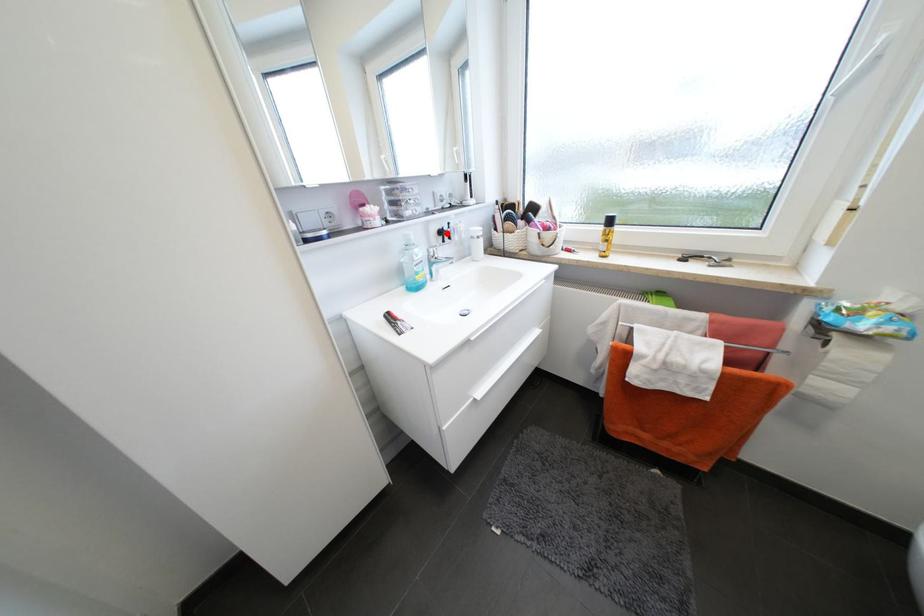
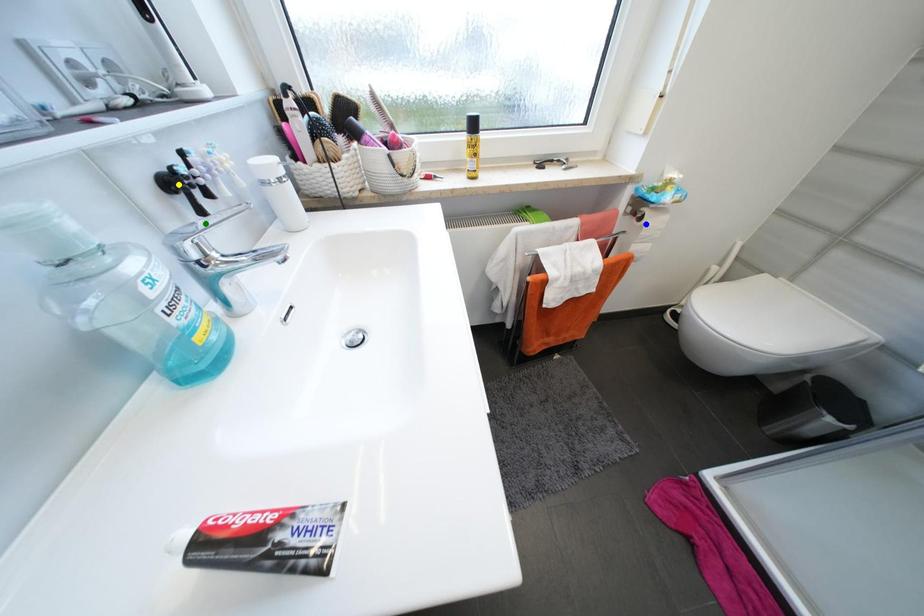
Question: I am providing you with two images of the same scene from different viewpoints. A red point is marked on the first image. You are given multiple points on the second image. Which mark in image 2 goes with the point in image 1?

Choices:
 (A) green point
 (B) yellow point
 (C) blue point

Answer: (B)